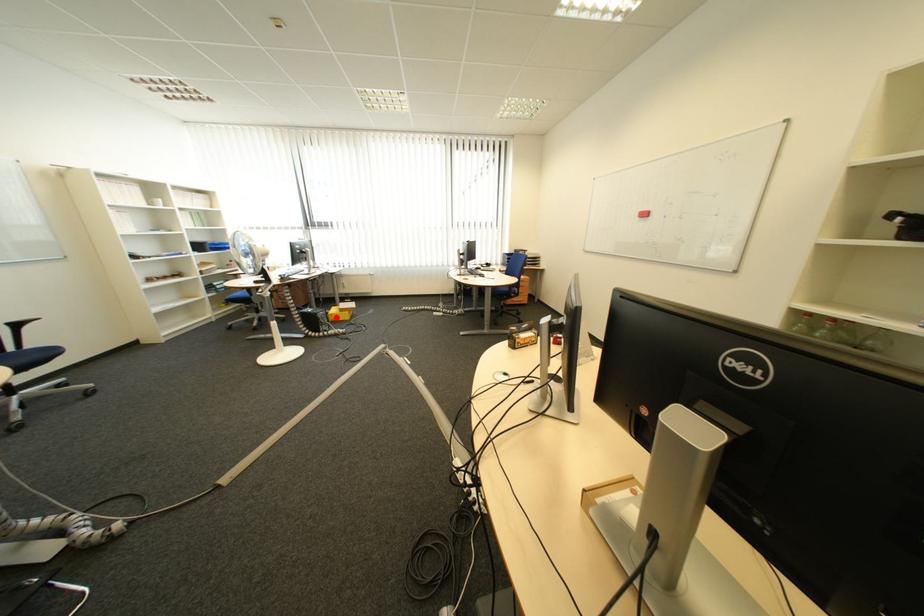
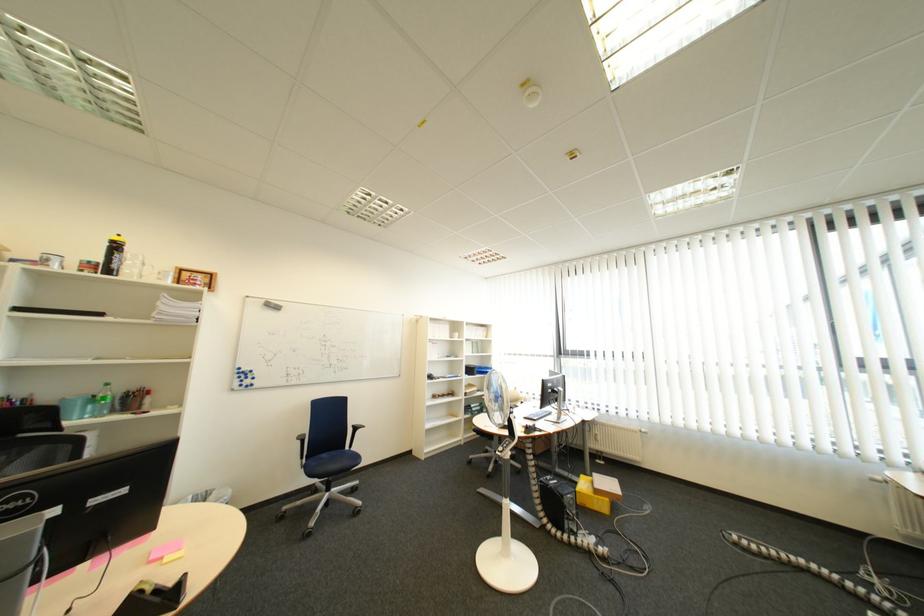
Locate, in the second image, the point that corresponds to the highlighted location in the first image.

(585, 503)